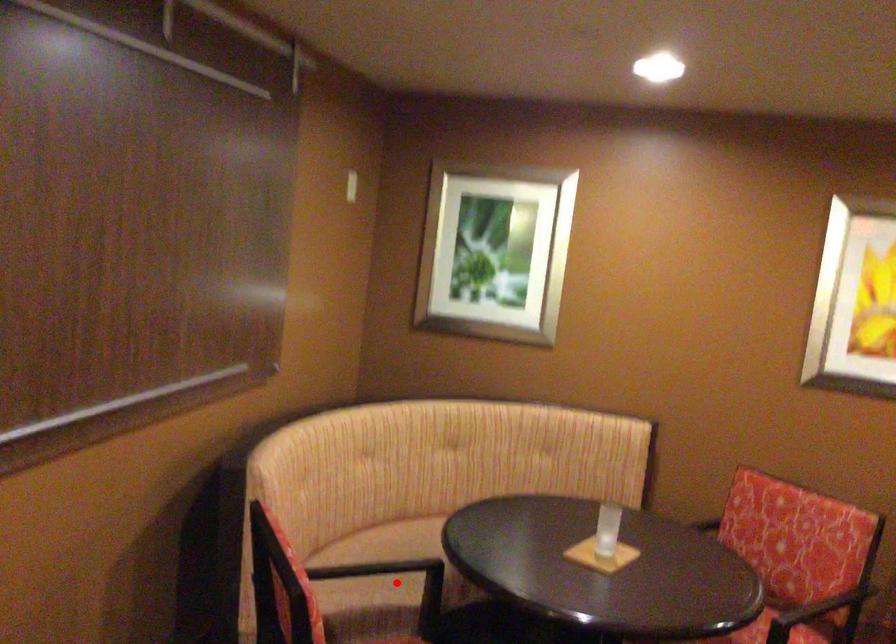
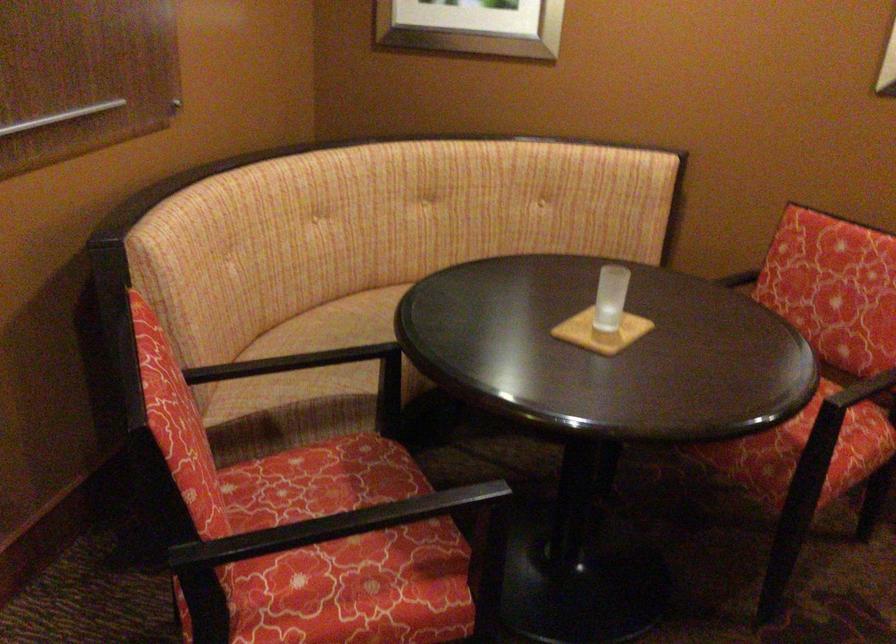
Find the pixel in the second image that matches the highlighted location in the first image.

(362, 357)